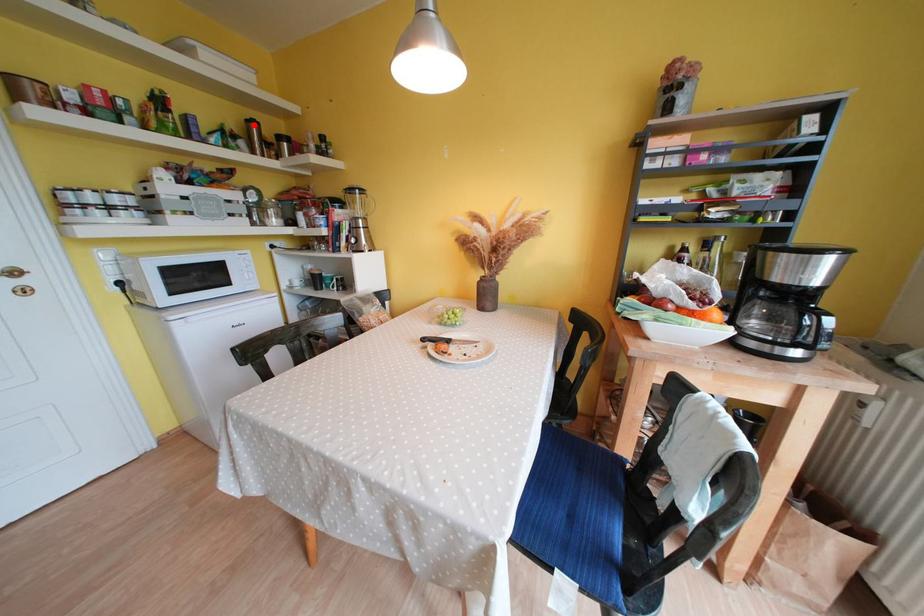
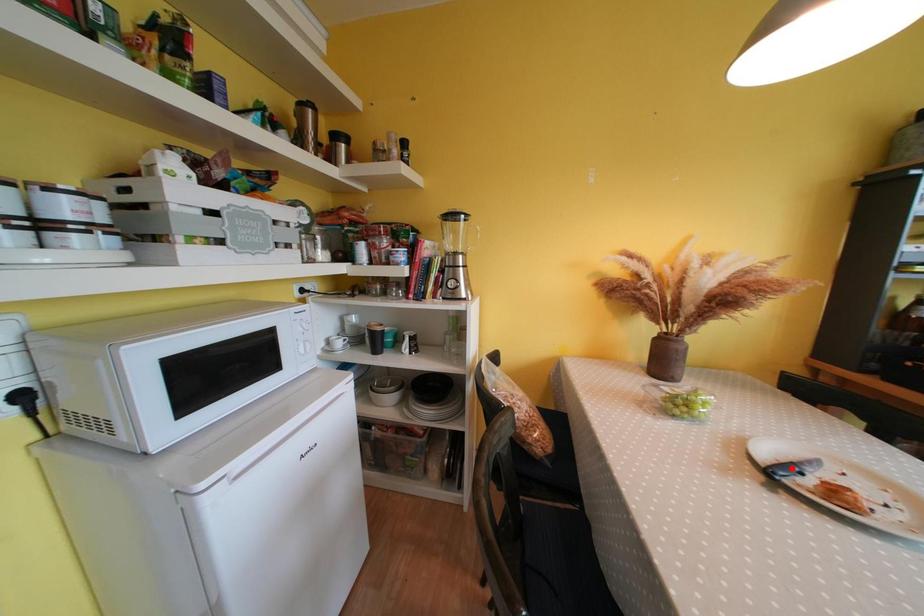
I am providing you with two images of the same scene from different viewpoints. A red point is marked on the first image and another point is marked on the second image. Is the marked point in image1 the same physical position as the marked point in image2?

No